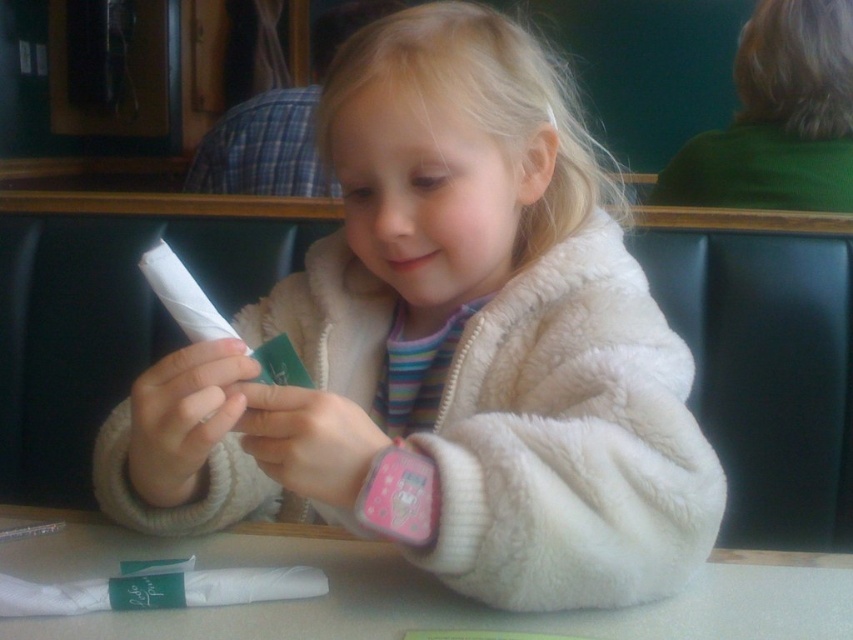
Question: Which of the following is the farthest from the observer?

Choices:
 (A) white fluffy coat at center
 (B) white matte table at center

Answer: (B)

Question: Can you confirm if white fluffy coat at center is positioned to the left of white matte table at center?

Choices:
 (A) yes
 (B) no

Answer: (B)

Question: Among these objects, which one is farthest from the camera?

Choices:
 (A) white matte table at center
 (B) white fluffy coat at center

Answer: (A)

Question: Which of the following is the farthest from the observer?

Choices:
 (A) (376, 625)
 (B) (370, 44)

Answer: (B)

Question: Can you confirm if white fluffy coat at center is positioned to the left of white matte table at center?

Choices:
 (A) yes
 (B) no

Answer: (B)

Question: Can you confirm if white fluffy coat at center is wider than white matte table at center?

Choices:
 (A) no
 (B) yes

Answer: (A)